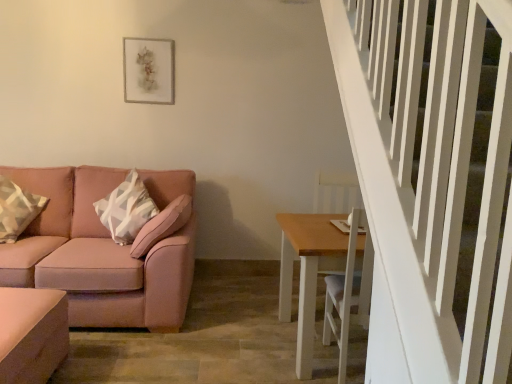
What do you see at coordinates (148, 70) in the screenshot?
I see `matte gray picture frame at upper center` at bounding box center [148, 70].

The height and width of the screenshot is (384, 512). What do you see at coordinates (32, 334) in the screenshot? I see `matte pink ottoman at lower left, which is the second table from right to left` at bounding box center [32, 334].

The height and width of the screenshot is (384, 512). In order to click on matte gray picture frame at upper center in this screenshot , I will do click(x=148, y=70).

From the image's perspective, is geometric-patterned fabric pillow at left located beneath pink fabric couch at left?

No, from the image's perspective, geometric-patterned fabric pillow at left is not below pink fabric couch at left.

What's the angular difference between geometric-patterned fabric pillow at left and pink fabric couch at left's facing directions?

The angle between the facing direction of geometric-patterned fabric pillow at left and the facing direction of pink fabric couch at left is 37 degrees.

Is geometric-patterned fabric pillow at left taller or shorter than pink fabric couch at left?

geometric-patterned fabric pillow at left is shorter than pink fabric couch at left.

Is geometric-patterned fabric pillow at left smaller than pink fabric couch at left?

Yes, geometric-patterned fabric pillow at left is smaller than pink fabric couch at left.

Between geometric-patterned fabric pillow at left and light brown wooden table at lower right, acting as the 1th table starting from the right, which one has more height?

Standing taller between the two is light brown wooden table at lower right, acting as the 1th table starting from the right.

Between point (12, 204) and point (280, 222), which one is positioned in front?

The point (280, 222) is closer.

Does geometric-patterned fabric pillow at left appear on the left side of light brown wooden table at lower right, which is the second table from left to right?

Yes.

Is pink fabric couch at left looking in the opposite direction of matte gray picture frame at upper center?

No.

In terms of height, does pink fabric couch at left look taller or shorter compared to matte gray picture frame at upper center?

pink fabric couch at left is taller than matte gray picture frame at upper center.

Are pink fabric couch at left and matte gray picture frame at upper center making contact?

pink fabric couch at left is not next to matte gray picture frame at upper center, and they're not touching.

Can you confirm if pink fabric couch at left is bigger than matte gray picture frame at upper center?

Yes, pink fabric couch at left is bigger than matte gray picture frame at upper center.

Consider the image. Is light brown wooden table at lower right, which is the second table from left to right, at the back of pink fabric couch at left?

No.

The width and height of the screenshot is (512, 384). In order to click on studio couch that is on the left side of light brown wooden table at lower right, which is the second table from left to right in this screenshot , I will do `click(106, 248)`.

Based on the photo, from the image's perspective, which is above, pink fabric couch at left or light brown wooden table at lower right, which is the second table from left to right?

From the image's view, pink fabric couch at left is above.

From a real-world perspective, is pink fabric couch at left over light brown wooden table at lower right, acting as the 1th table starting from the right?

Yes, from a real-world perspective, pink fabric couch at left is over light brown wooden table at lower right, acting as the 1th table starting from the right

From a real-world perspective, which is physically below, geometric-patterned fabric pillow at left or matte pink ottoman at lower left, which is the second table from right to left?

In real-world perspective, matte pink ottoman at lower left, which is the second table from right to left, is lower.

Relative to matte pink ottoman at lower left, which is the second table from right to left, is geometric-patterned fabric pillow at left in front or behind?

geometric-patterned fabric pillow at left is behind matte pink ottoman at lower left, which is the second table from right to left.

Is geometric-patterned fabric pillow at left aimed at matte pink ottoman at lower left, the 1th table positioned from the left?

Yes, geometric-patterned fabric pillow at left is turned towards matte pink ottoman at lower left, the 1th table positioned from the left.

Is geometric-patterned fabric pillow at left to the left of matte pink ottoman at lower left, the 1th table positioned from the left, from the viewer's perspective?

Correct, you'll find geometric-patterned fabric pillow at left to the left of matte pink ottoman at lower left, the 1th table positioned from the left.

Is geometric-patterned fabric pillow at left next to matte gray picture frame at upper center and touching it?

No, geometric-patterned fabric pillow at left is not in contact with matte gray picture frame at upper center.

Based on the photo, how distant is geometric-patterned fabric pillow at left from matte gray picture frame at upper center?

They are 1.26 meters apart.

In the image, there is a geometric-patterned fabric pillow at left. Where is `picture frame above it (from the image's perspective)`? picture frame above it (from the image's perspective) is located at coordinates (148, 70).

Between point (1, 214) and point (169, 41), which one is positioned behind?

Positioned behind is point (169, 41).

Is matte pink ottoman at lower left, which is the second table from right to left, positioned far away from geometric-patterned fabric pillow at left?

Yes, matte pink ottoman at lower left, which is the second table from right to left, and geometric-patterned fabric pillow at left are quite far apart.

Could geometric-patterned fabric pillow at left be considered to be inside matte pink ottoman at lower left, which is the second table from right to left?

No, geometric-patterned fabric pillow at left is not surrounded by matte pink ottoman at lower left, which is the second table from right to left.

From a real-world perspective, which is physically below, matte pink ottoman at lower left, the 1th table positioned from the left, or geometric-patterned fabric pillow at left?

matte pink ottoman at lower left, the 1th table positioned from the left.

Is matte pink ottoman at lower left, which is the second table from right to left, smaller than geometric-patterned fabric pillow at left?

Incorrect, matte pink ottoman at lower left, which is the second table from right to left, is not smaller in size than geometric-patterned fabric pillow at left.

The height and width of the screenshot is (384, 512). Find the location of `studio couch below the geometric-patterned fabric pillow at left (from the image's perspective)`. studio couch below the geometric-patterned fabric pillow at left (from the image's perspective) is located at coordinates (106, 248).

The image size is (512, 384). In order to click on pillow on the left of light brown wooden table at lower right, which is the second table from left to right in this screenshot , I will do point(17,209).

Consider the image. Which object lies nearer to the anchor point matte pink ottoman at lower left, which is the second table from right to left, pink fabric couch at left or light brown wooden table at lower right, acting as the 1th table starting from the right?

pink fabric couch at left.

Looking at the image, which one is located further to geometric-patterned fabric pillow at left, matte pink ottoman at lower left, the 1th table positioned from the left, or light brown wooden table at lower right, which is the second table from left to right?

light brown wooden table at lower right, which is the second table from left to right.

Considering their positions, is geometric-patterned fabric pillow at left positioned closer to matte pink ottoman at lower left, which is the second table from right to left, than pink fabric couch at left?

Based on the image, pink fabric couch at left appears to be nearer to matte pink ottoman at lower left, which is the second table from right to left.

Based on their spatial positions, is matte pink ottoman at lower left, the 1th table positioned from the left, or geometric-patterned fabric pillow at left closer to pink fabric couch at left?

geometric-patterned fabric pillow at left is closer to pink fabric couch at left.

Estimate the real-world distances between objects in this image. Which object is closer to geometric-patterned fabric pillow at left, light brown wooden table at lower right, acting as the 1th table starting from the right, or matte gray picture frame at upper center?

matte gray picture frame at upper center.

Based on their spatial positions, is geometric-patterned fabric pillow at left or pink fabric couch at left further from light brown wooden table at lower right, which is the second table from left to right?

Based on the image, geometric-patterned fabric pillow at left appears to be further to light brown wooden table at lower right, which is the second table from left to right.

Estimate the real-world distances between objects in this image. Which object is further from light brown wooden table at lower right, acting as the 1th table starting from the right, pink fabric couch at left or geometric-patterned fabric pillow at left?

geometric-patterned fabric pillow at left.

From the image, which object appears to be farther from geometric-patterned fabric pillow at left, pink fabric couch at left or light brown wooden table at lower right, acting as the 1th table starting from the right?

light brown wooden table at lower right, acting as the 1th table starting from the right, is positioned further to the anchor geometric-patterned fabric pillow at left.

The width and height of the screenshot is (512, 384). I want to click on table between pink fabric couch at left and light brown wooden table at lower right, which is the second table from left to right, so (32, 334).

At what (x,y) coordinates should I click in order to perform the action: click on studio couch between matte gray picture frame at upper center and matte pink ottoman at lower left, which is the second table from right to left, in the vertical direction. Please return your answer as a coordinate pair (x, y). Image resolution: width=512 pixels, height=384 pixels. Looking at the image, I should click on (106, 248).

This screenshot has height=384, width=512. I want to click on studio couch between geometric-patterned fabric pillow at left and light brown wooden table at lower right, which is the second table from left to right, from left to right, so click(x=106, y=248).

At what (x,y) coordinates should I click in order to perform the action: click on pillow between matte gray picture frame at upper center and pink fabric couch at left vertically. Please return your answer as a coordinate pair (x, y). The height and width of the screenshot is (384, 512). Looking at the image, I should click on (17, 209).